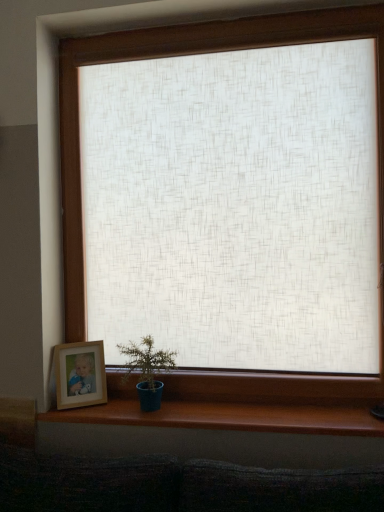
I want to click on space that is in front of wooden picture frame at lower left, so click(78, 411).